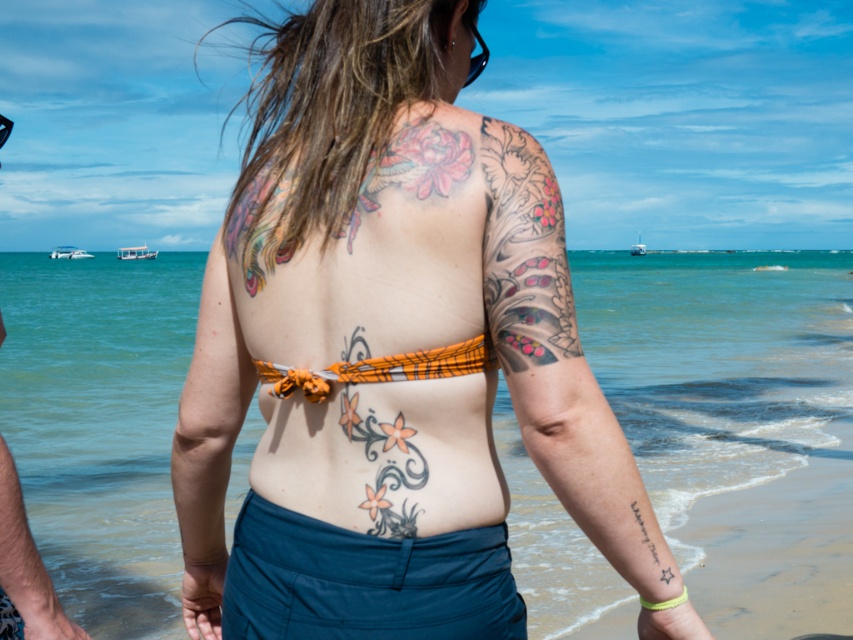
You are a photographer taking a picture of the person at the beach. You notice the clear blue water at center and the smooth skin at left. Which object is higher in the image?

The clear blue water at center is higher in the image than the smooth skin at left.

You are a tattoo artist observing the person at the beach. You need to apply a new tattoo between the smooth skin at left and the black ink star at lower right. Which area should you choose if you want to place it closer to the left side?

The smooth skin at left is positioned on the left side of black ink star at lower right, so you should choose the smooth skin at left to place the new tattoo closer to the left side.

You are a fashion designer observing the beach scene. You need to determine if the orange fabric bikini top at center can be replaced with a smaller bikini top without changing its position. Can it fit if the new bikini top is the same size as the smooth skin at left?

The orange fabric bikini top at center is bigger than smooth skin at left. Since the new bikini top would be the same size as the smooth skin at left, which is smaller, it can fit in the same position.